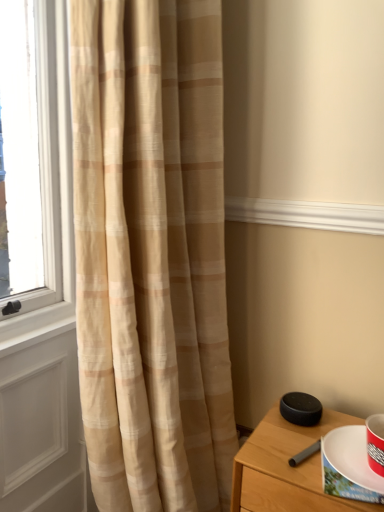
Question: In terms of height, does black matte speaker at lower right look taller or shorter compared to white paper plate at lower right?

Choices:
 (A) tall
 (B) short

Answer: (A)

Question: In terms of width, does black matte speaker at lower right look wider or thinner when compared to white paper plate at lower right?

Choices:
 (A) thin
 (B) wide

Answer: (B)

Question: Which is nearer to the black matte speaker at lower right?

Choices:
 (A) white paper plate at lower right
 (B) translucent beige curtain at left
 (C) beige textured curtain at left

Answer: (A)

Question: Based on their relative distances, which object is nearer to the black matte speaker at lower right?

Choices:
 (A) white paper plate at lower right
 (B) translucent beige curtain at left
 (C) beige textured curtain at left

Answer: (A)